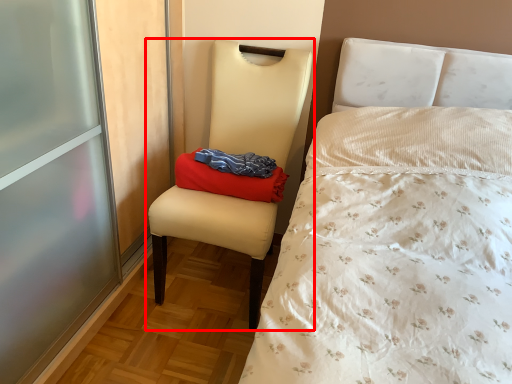
Question: From the image's perspective, what is the correct spatial relationship of chair (annotated by the red box) in relation to pillow?

Choices:
 (A) below
 (B) above

Answer: (A)